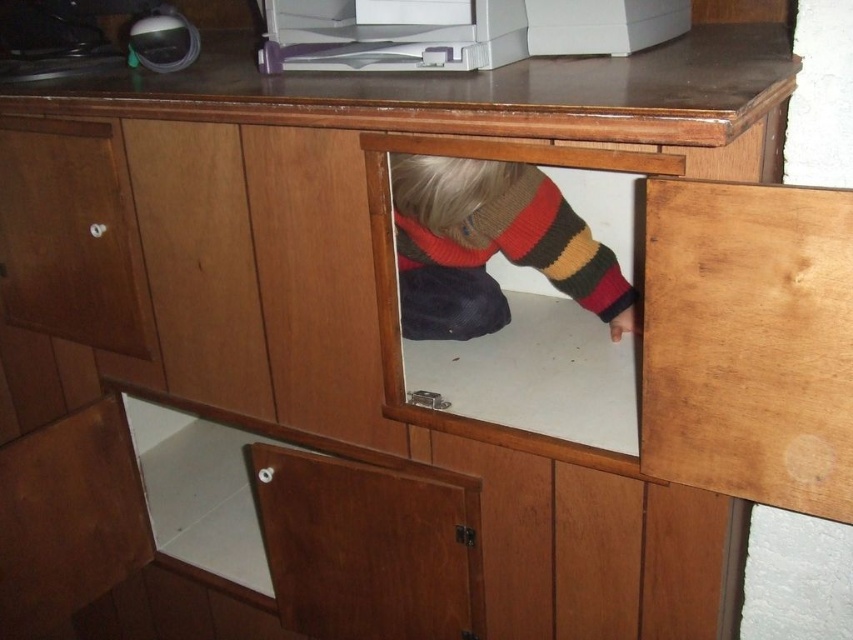
Is matte wood drawer at left above white plastic printer at upper center?

No.

Based on the photo, between matte wood drawer at left and white plastic printer at upper center, which one has less height?

Standing shorter between the two is white plastic printer at upper center.

The height and width of the screenshot is (640, 853). In order to click on matte wood drawer at left in this screenshot , I will do `click(71, 236)`.

This screenshot has width=853, height=640. Describe the element at coordinates (71, 236) in the screenshot. I see `matte wood drawer at left` at that location.

Is the position of matte wood drawer at left less distant than that of knitted sweater at center?

No, it is behind knitted sweater at center.

Does point (15, 234) come closer to viewer compared to point (509, 256)?

That is True.

Identify the location of matte wood drawer at left. (71, 236).

In the scene shown: Does knitted sweater at center have a lesser height compared to white plastic printer at upper center?

No.

Between knitted sweater at center and white plastic printer at upper center, which one appears on the right side from the viewer's perspective?

white plastic printer at upper center is more to the right.

Who is more distant from viewer, (527, 211) or (538, 36)?

Positioned behind is point (527, 211).

The image size is (853, 640). What are the coordinates of `knitted sweater at center` in the screenshot? It's located at (491, 244).